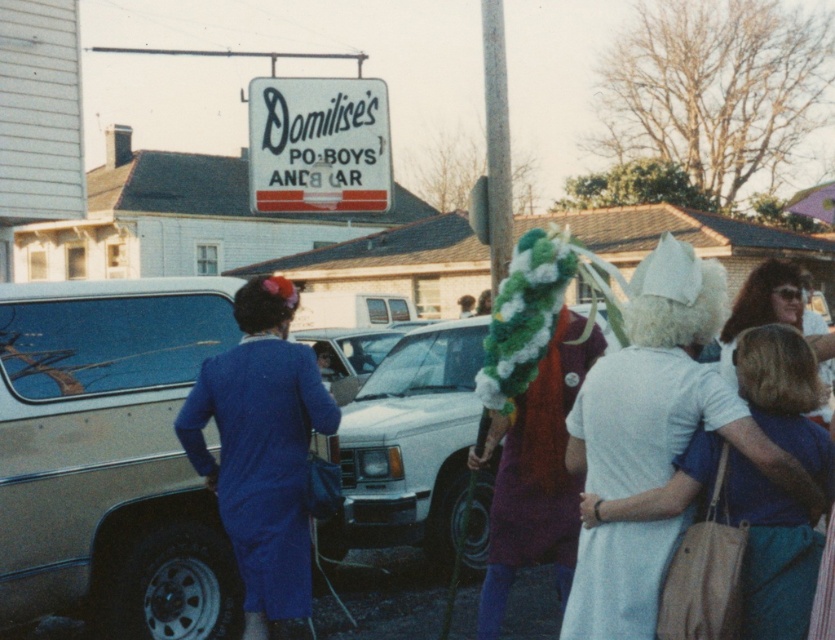
Question: Which object appears closest to the camera in this image?

Choices:
 (A) white cotton dress at center
 (B) matte blue dress at left
 (C) white glossy car at center

Answer: (A)

Question: Which object appears closest to the camera in this image?

Choices:
 (A) white glossy car at center
 (B) matte blue dress at left

Answer: (B)

Question: Is matte gold minivan at left to the right of white cotton dress at center from the viewer's perspective?

Choices:
 (A) yes
 (B) no

Answer: (B)

Question: Among these objects, which one is nearest to the camera?

Choices:
 (A) blonde hair at center
 (B) white cotton dress at center
 (C) white glossy car at center

Answer: (B)

Question: Is matte blue dress at left in front of blonde hair at center?

Choices:
 (A) no
 (B) yes

Answer: (A)

Question: Where is white cotton dress at center located in relation to blonde hair at center in the image?

Choices:
 (A) left
 (B) right

Answer: (A)